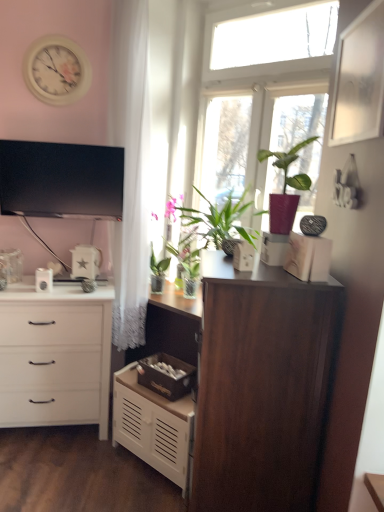
Question: Can you confirm if white matte chest of drawers at lower center, positioned as the 2th chest of drawers in left-to-right order, is taller than brown wooden storage box at center, positioned as the first storage box in back-to-front order?

Choices:
 (A) yes
 (B) no

Answer: (A)

Question: Does white matte chest of drawers at lower center, positioned as the 2th chest of drawers in left-to-right order, come in front of brown wooden storage box at center, positioned as the first storage box in back-to-front order?

Choices:
 (A) no
 (B) yes

Answer: (B)

Question: From a real-world perspective, is white matte chest of drawers at lower center, which is the 1th chest of drawers in right-to-left order, positioned under brown wooden storage box at center, which is counted as the second storage box, starting from the top, based on gravity?

Choices:
 (A) yes
 (B) no

Answer: (A)

Question: Would you say white matte chest of drawers at lower center, positioned as the 2th chest of drawers in left-to-right order, contains brown wooden storage box at center, acting as the second storage box starting from the right?

Choices:
 (A) yes
 (B) no

Answer: (B)

Question: Is white matte chest of drawers at lower center, which is the 1th chest of drawers in right-to-left order, not close to brown wooden storage box at center, the first storage box from the left?

Choices:
 (A) yes
 (B) no

Answer: (B)

Question: From a real-world perspective, is white matte chest of drawers at lower center, which is the 1th chest of drawers in right-to-left order, on top of brown wooden storage box at center, which ranks as the first storage box in bottom-to-top order?

Choices:
 (A) yes
 (B) no

Answer: (B)

Question: Is white sheer curtain at left oriented away from white glossy kettle at left, the third appliance when ordered from right to left?

Choices:
 (A) yes
 (B) no

Answer: (A)

Question: Does white sheer curtain at left lie in front of white glossy kettle at left, the third appliance when ordered from right to left?

Choices:
 (A) no
 (B) yes

Answer: (B)

Question: From a real-world perspective, does white sheer curtain at left stand above white glossy kettle at left, which is counted as the second appliance, starting from the front?

Choices:
 (A) yes
 (B) no

Answer: (A)

Question: Considering the relative sizes of white sheer curtain at left and white glossy kettle at left, the 2th appliance viewed from the back, in the image provided, is white sheer curtain at left taller than white glossy kettle at left, the 2th appliance viewed from the back,?

Choices:
 (A) no
 (B) yes

Answer: (B)

Question: Is white sheer curtain at left shorter than white glossy kettle at left, the third appliance when ordered from right to left?

Choices:
 (A) yes
 (B) no

Answer: (B)

Question: Does white sheer curtain at left have a lesser width compared to white glossy kettle at left, the third appliance when ordered from right to left?

Choices:
 (A) yes
 (B) no

Answer: (B)

Question: From the image's perspective, is white glossy kettle at left, the first appliance when ordered from left to right, under white matte chest of drawers at left, which appears as the 2th chest of drawers when viewed from the right?

Choices:
 (A) no
 (B) yes

Answer: (A)